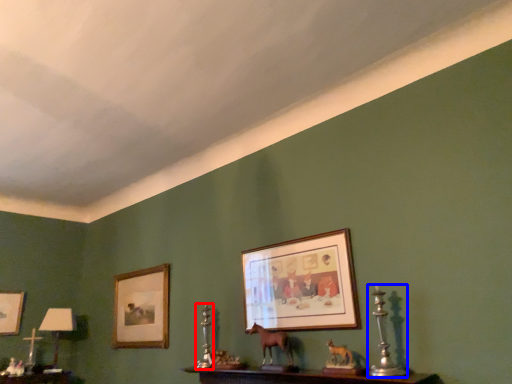
Question: Which of the following is the closest to the observer, candle holder (highlighted by a red box) or candle holder (highlighted by a blue box)?

Choices:
 (A) candle holder
 (B) candle holder

Answer: (B)